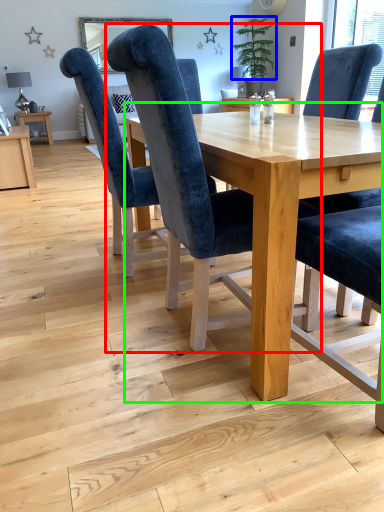
Question: Which object is positioned farthest from chair (highlighted by a red box)? Select from plant (highlighted by a blue box) and table (highlighted by a green box).

Choices:
 (A) plant
 (B) table

Answer: (A)